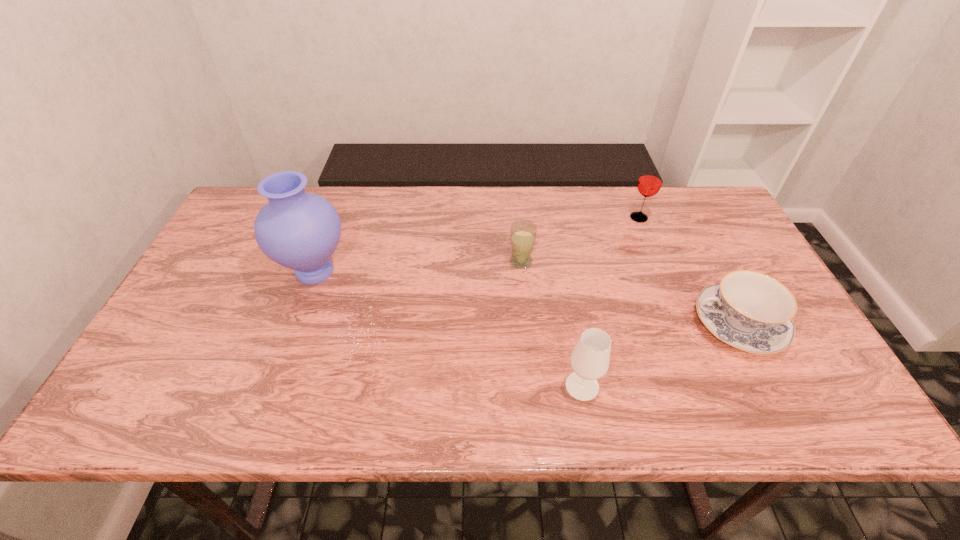
You are a GUI agent. You are given a task and a screenshot of the screen. Output one action in this format:
    pyautogui.click(x=<x>, y=<y>)
    Task: Click on the blank region between the leftmost object and the second glass from left to right
    
    Given the screenshot: What is the action you would take?
    pyautogui.click(x=448, y=329)

Locate an element on the screen. vacant area that lies between the second farthest glass and the leftmost object is located at coordinates (418, 266).

At what (x,y) coordinates should I click in order to perform the action: click on vacant area between the chinaware and the second nearest glass. Please return your answer as a coordinate pair (x, y). Looking at the image, I should click on (629, 293).

The image size is (960, 540). I want to click on object that stands as the closest to the fourth object from right to left, so click(x=590, y=358).

Identify the location of object that stands as the second closest to the farthest object. The image size is (960, 540). (523, 233).

Point out which glass is positioned as the nearest to the nearest object. Please provide its 2D coordinates. Your answer should be formatted as a tuple, i.e. [(x, y)], where the tuple contains the x and y coordinates of a point satisfying the conditions above.

[(523, 233)]

Where is `glass that is the third closest to the chinaware`? glass that is the third closest to the chinaware is located at coordinates (523, 233).

The width and height of the screenshot is (960, 540). I want to click on free space that satisfies the following two spatial constraints: 1. on the front side of the second glass from right to left; 2. on the right side of the vase, so click(273, 386).

The height and width of the screenshot is (540, 960). What are the coordinates of `free location that satisfies the following two spatial constraints: 1. on the back side of the farthest glass; 2. on the left side of the third object from left to right` in the screenshot? It's located at (552, 218).